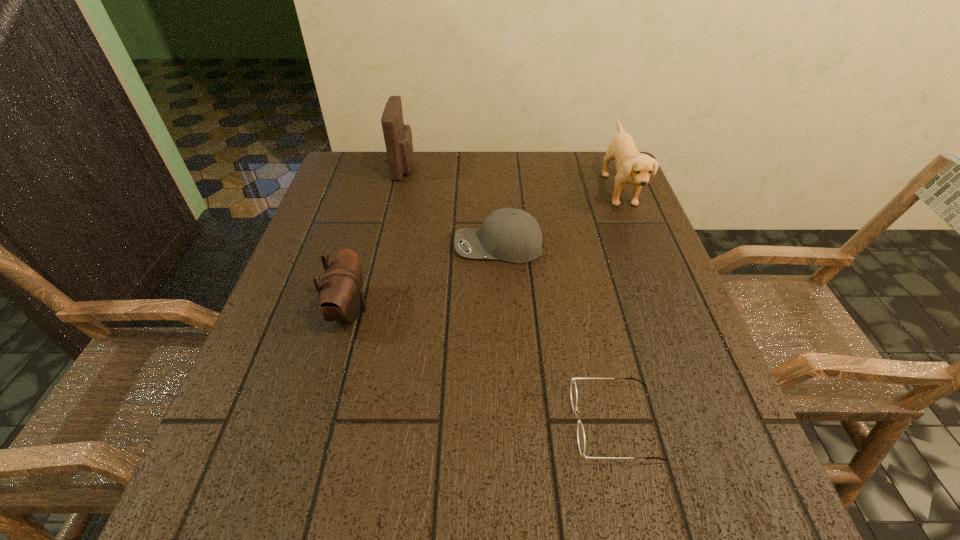
At what (x,y) coordinates should I click in order to perform the action: click on puppy present at the far edge. Please return your answer as a coordinate pair (x, y). This screenshot has width=960, height=540. Looking at the image, I should click on (632, 167).

At what (x,y) coordinates should I click in order to perform the action: click on puppy that is positioned at the right edge. Please return your answer as a coordinate pair (x, y). The height and width of the screenshot is (540, 960). Looking at the image, I should click on (632, 167).

Locate an element on the screen. This screenshot has width=960, height=540. spectacles that is at the right edge is located at coordinates (573, 390).

This screenshot has height=540, width=960. Identify the location of object located at the far left corner. (398, 137).

At what (x,y) coordinates should I click in order to perform the action: click on object positioned at the far right corner. Please return your answer as a coordinate pair (x, y). Looking at the image, I should click on (632, 167).

The width and height of the screenshot is (960, 540). In the image, there is a desktop. In order to click on blank space at the far edge in this screenshot , I will do `click(506, 184)`.

This screenshot has width=960, height=540. I want to click on free region at the near edge, so click(x=535, y=478).

In the image, there is a desktop. Where is `vacant space at the left edge`? vacant space at the left edge is located at coordinates (308, 352).

In the image, there is a desktop. Where is `vacant space at the right edge`? vacant space at the right edge is located at coordinates (644, 276).

You are a GUI agent. You are given a task and a screenshot of the screen. Output one action in this format:
    pyautogui.click(x=<x>, y=<y>)
    Task: Click on the free space at the far left corner of the desktop
    The height and width of the screenshot is (540, 960).
    Given the screenshot: What is the action you would take?
    pyautogui.click(x=371, y=181)